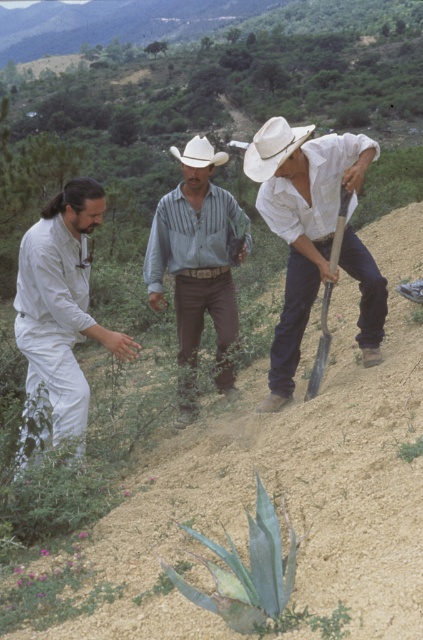
Question: Does white matte suit at left lie in front of wooden shovel at center?

Choices:
 (A) no
 (B) yes

Answer: (B)

Question: Among these points, which one is farthest from the camera?

Choices:
 (A) (315, 374)
 (B) (25, 312)

Answer: (A)

Question: Does white straw cowboy hat at center have a larger size compared to wooden shovel at center?

Choices:
 (A) yes
 (B) no

Answer: (A)

Question: Does wooden shovel at center have a larger size compared to white felt cowboy hat at center?

Choices:
 (A) yes
 (B) no

Answer: (B)

Question: Which point appears closest to the camera in this image?

Choices:
 (A) (375, 301)
 (B) (211, 214)
 (C) (206, 154)
 (D) (49, 243)

Answer: (D)

Question: Which of the following is the farthest from the observer?

Choices:
 (A) white felt cowboy hat at center
 (B) white straw cowboy hat at center

Answer: (A)